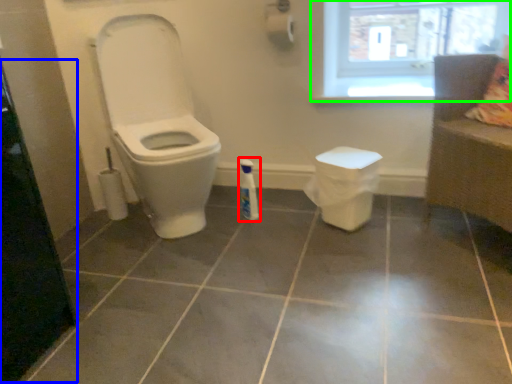
Question: Which object is positioned farthest from cleaning product (highlighted by a red box)? Select from screen door (highlighted by a blue box) and window (highlighted by a green box).

Choices:
 (A) screen door
 (B) window

Answer: (A)